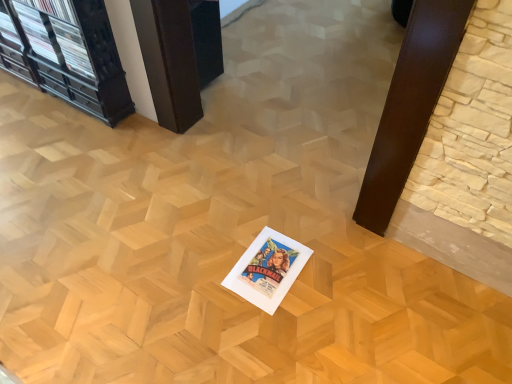
I want to click on vacant area located to the right-hand side of white paper at center, so click(328, 272).